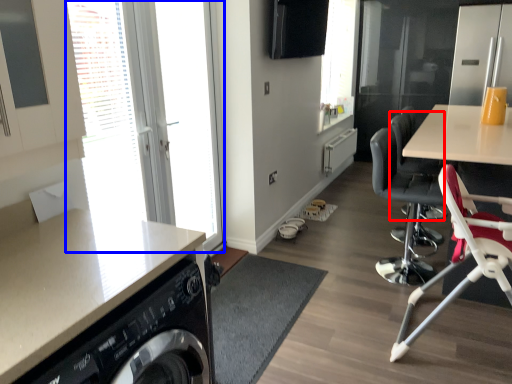
Question: Which object is further to the camera taking this photo, armchair (highlighted by a red box) or window (highlighted by a blue box)?

Choices:
 (A) armchair
 (B) window

Answer: (A)